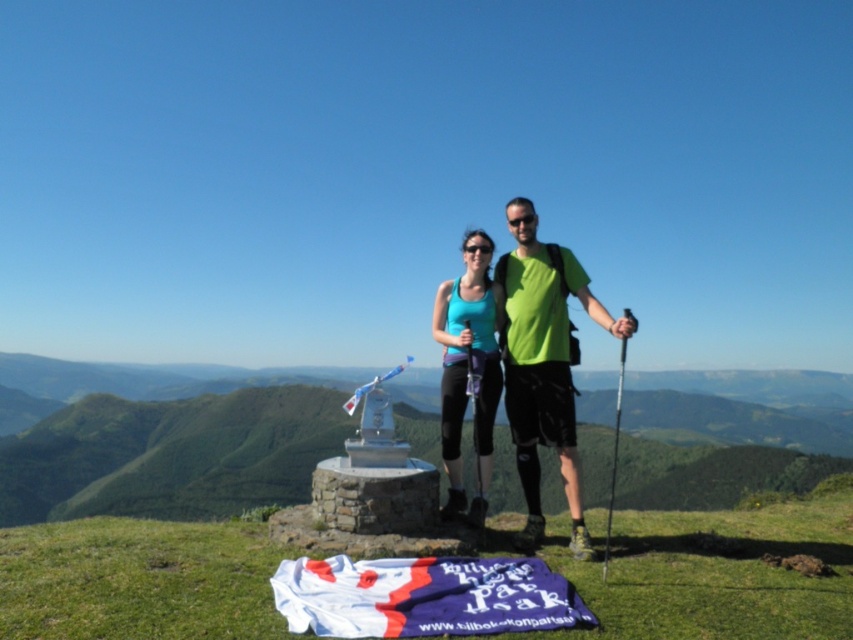
You are a photographer trying to capture a photo of the white fabric flag at lower center and the teal fabric tank top at center. Which object appears taller in the photo?

The white fabric flag at lower center is not as tall as the teal fabric tank top at center, so the teal fabric tank top at center appears taller in the photo.

A hiker wants to place a 1.5 meter long flagpole between the two points marked as point (552, 316) and point 0.302, 0.456. Will the flagpole fit without overlapping either point?

The distance between the two points marked as point (552, 316) and point 0.302, 0.456 is 6.44 meters. Since the flagpole is only 1.5 meters long, there is sufficient space between them to place it without overlapping either point.

You are a photographer planning to take a group photo of the two people in the image. You need to ensure that both the white fabric flag at lower center and the green matte tank top at center are visible in the frame. Given their sizes, which object might require you to adjust your camera angle to include it properly?

The white fabric flag at lower center is shorter than the green matte tank top at center, so the green matte tank top at center may require adjusting the camera angle to ensure it fits within the frame due to its greater height.